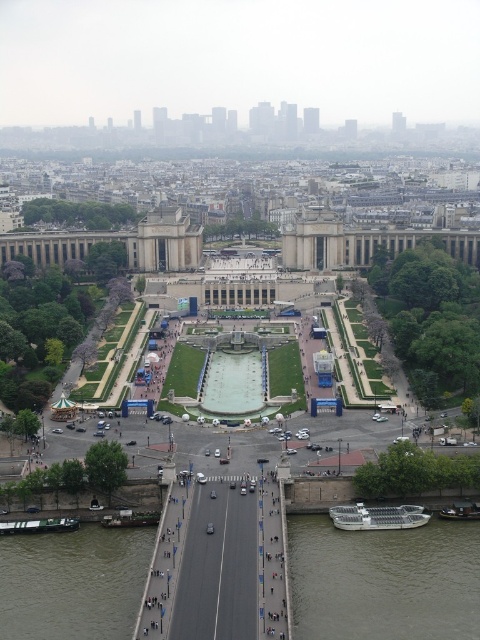
You are standing at the center of the city square facing the grand building. You want to find the brown murky water at lower left. In which direction should you turn to locate it?

The brown murky water at lower left is located at point coordinates, so you should turn to your lower left direction to find it.

You are planning to pass under the bridge with your boat. You see a metallic silver boat at lower right and a wooden boat at lower left. Which boat do you need to avoid if your boat is taller than the clearance height of the bridge?

You should avoid the metallic silver boat at lower right because it has a greater height compared to the wooden boat at lower left, indicating it might not pass under the bridge if your boat is already taller than the clearance height.

You are a photographer planning to capture a wide shot of the city square while including both the metallic silver boat at lower right and the wooden boat at lower left. Given their sizes, which boat will occupy more space in your photo?

The metallic silver boat at lower right will occupy more space in the photo since its width surpasses that of the wooden boat at lower left.